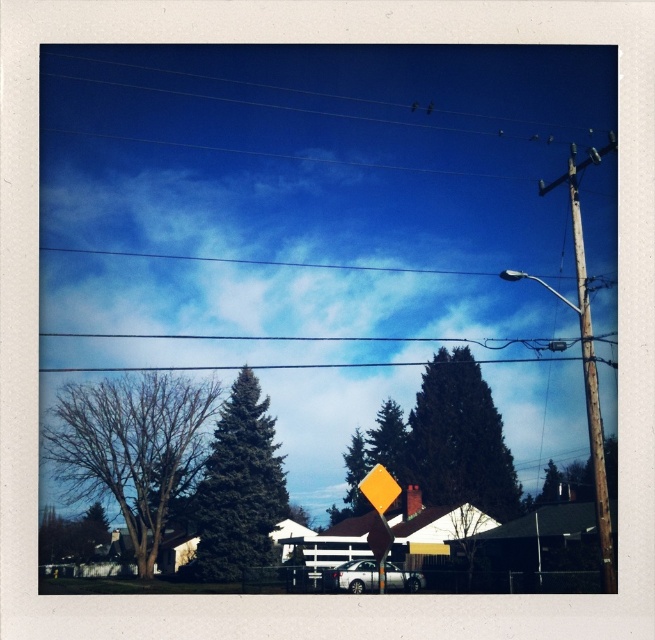
Which is more to the left, green matte evergreen tree at center or weathered wood telegraph pole at right?

green matte evergreen tree at center is more to the left.

Does green matte evergreen tree at center have a lesser width compared to weathered wood telegraph pole at right?

Yes.

Where is `green matte evergreen tree at center`? green matte evergreen tree at center is located at coordinates (238, 488).

The image size is (655, 640). I want to click on green matte evergreen tree at center, so click(x=238, y=488).

Is point (405, 429) closer to viewer compared to point (236, 417)?

That is False.

Can you confirm if dark green textured tree at center is smaller than green matte evergreen tree at center?

No.

Does point (440, 358) lie behind point (236, 406)?

That is True.

In order to click on dark green textured tree at center in this screenshot , I will do `click(440, 444)`.

Who is higher up, bare branches at left or weathered wood telegraph pole at right?

weathered wood telegraph pole at right is above.

Can you confirm if bare branches at left is positioned below weathered wood telegraph pole at right?

Indeed, bare branches at left is positioned under weathered wood telegraph pole at right.

Is point (202, 442) more distant than point (571, 150)?

Yes, point (202, 442) is farther from viewer.

Locate an element on the screen. bare branches at left is located at coordinates (132, 448).